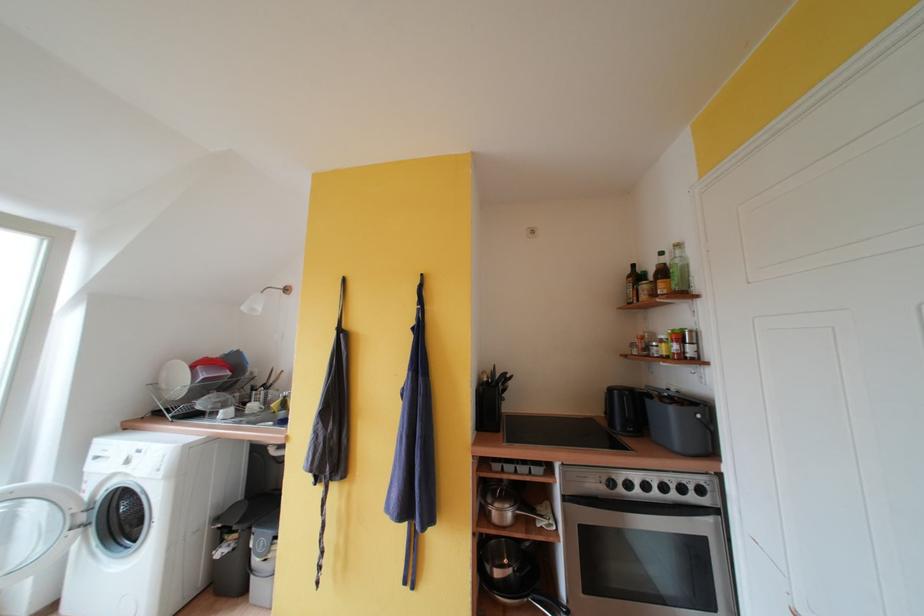
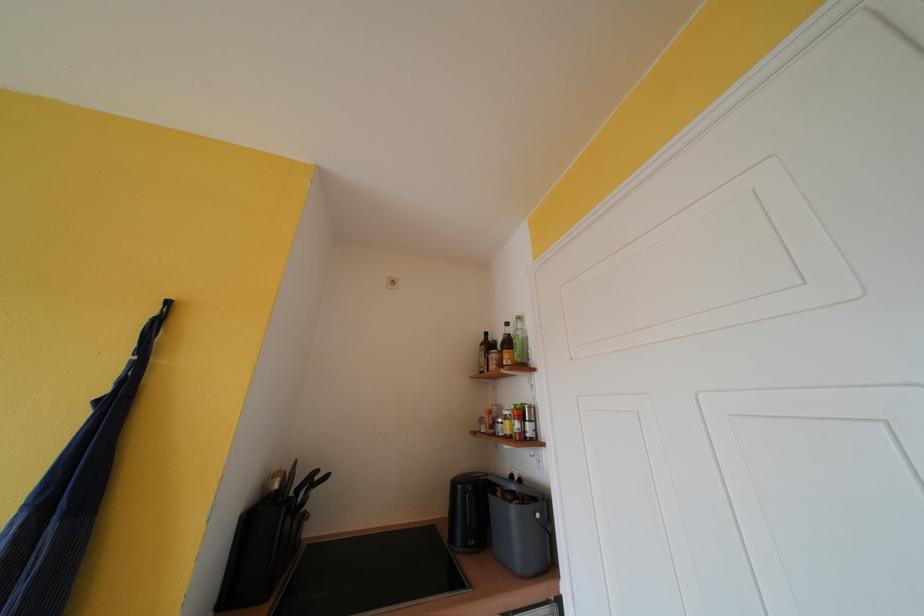
Question: The camera is either moving clockwise (left) or counter-clockwise (right) around the object. The first image is from the beginning of the video and the second image is from the end. Is the camera moving left or right when shooting the video?

Choices:
 (A) Left
 (B) Right

Answer: (A)